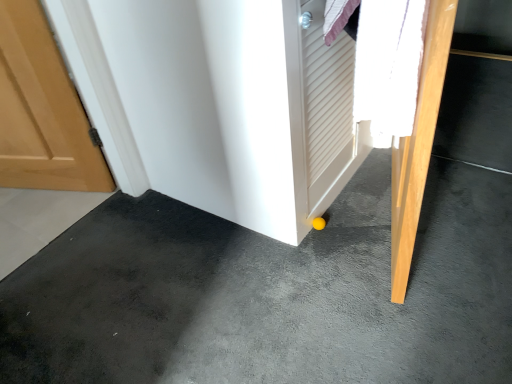
Question: Is yellow rubber ball at lower center far away from light wood door at lower right?

Choices:
 (A) no
 (B) yes

Answer: (A)

Question: Is the position of yellow rubber ball at lower center less distant than that of light wood door at lower right?

Choices:
 (A) no
 (B) yes

Answer: (B)

Question: Is yellow rubber ball at lower center at the left side of light wood door at lower right?

Choices:
 (A) yes
 (B) no

Answer: (A)

Question: Does yellow rubber ball at lower center have a larger size compared to light wood door at lower right?

Choices:
 (A) yes
 (B) no

Answer: (A)

Question: From the image's perspective, is yellow rubber ball at lower center under light wood door at lower right?

Choices:
 (A) yes
 (B) no

Answer: (A)

Question: Is yellow rubber ball at lower center smaller than light wood door at lower right?

Choices:
 (A) yes
 (B) no

Answer: (B)

Question: From the image's perspective, is light wood door at lower right located beneath yellow rubber ball at lower center?

Choices:
 (A) yes
 (B) no

Answer: (B)

Question: Is light wood door at lower right taller than yellow rubber ball at lower center?

Choices:
 (A) no
 (B) yes

Answer: (B)

Question: From the image's perspective, is light wood door at lower right located above yellow rubber ball at lower center?

Choices:
 (A) no
 (B) yes

Answer: (B)

Question: Could you tell me if light wood door at lower right is turned towards yellow rubber ball at lower center?

Choices:
 (A) yes
 (B) no

Answer: (B)

Question: Is light wood door at lower right at the left side of yellow rubber ball at lower center?

Choices:
 (A) yes
 (B) no

Answer: (B)

Question: Does light wood door at lower right have a larger size compared to yellow rubber ball at lower center?

Choices:
 (A) yes
 (B) no

Answer: (B)

Question: From the image's perspective, is yellow rubber ball at lower center positioned above or below light wood door at lower right?

Choices:
 (A) below
 (B) above

Answer: (A)